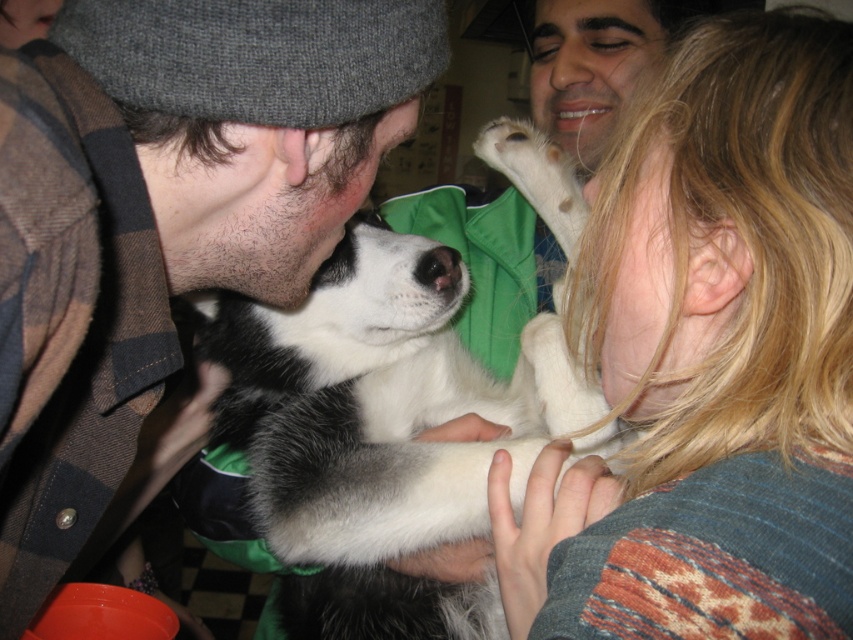
Based on the photo, you are a photographer trying to capture a candid shot of the fluffy gray hat at upper left and the matte skin nose at center. The camera you are using has a maximum focus range of 35 inches. Will both subjects be in focus if you focus on the closer one?

The fluffy gray hat at upper left and matte skin nose at center are 34.57 inches apart. If you focus on the closer one, the distance between them is within the camera maximum focus range of 35 inches, so both subjects will be in focus.

You are a photographer adjusting your camera settings to capture the scene. You notice the fluffy gray hat at upper left and the matte skin nose at center. Which object should you focus on first if you want to ensure both are in sharp focus, considering their positions?

The fluffy gray hat at upper left should be focused on first because it is taller than the matte skin nose at center, so focusing on the taller object first ensures depth of field covers both.

You are a photographer trying to capture a clear shot of the black and white fur at center. You notice the fluffy gray hat at upper left might block the view. Based on their heights, can you adjust your camera angle to avoid the hat?

The fluffy gray hat at upper left is not as tall as the black and white fur at center, so lowering the camera angle slightly should allow you to capture the black and white fur at center without obstruction from the hat.